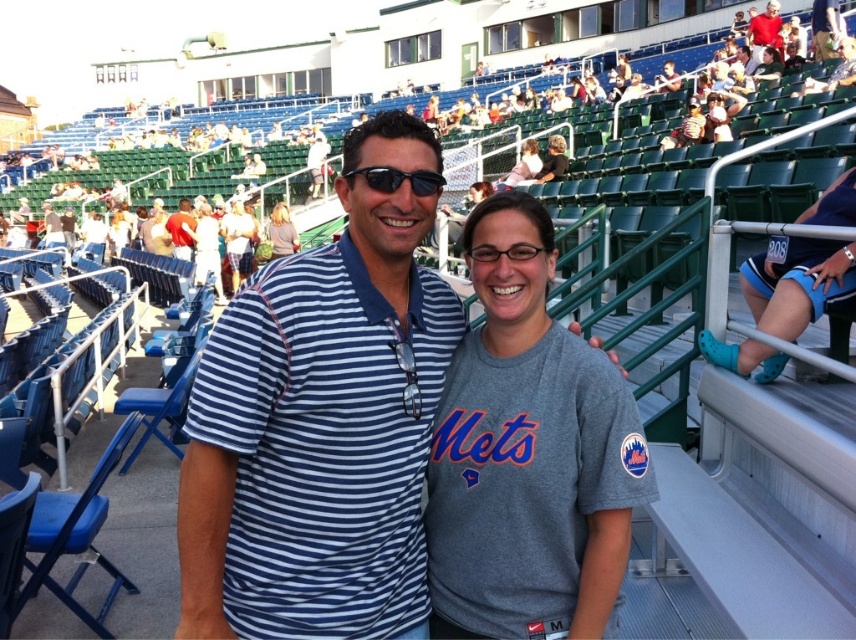
Who is positioned more to the right, blue striped polo shirt at center or gray cotton shirt at upper center?

gray cotton shirt at upper center

Does blue striped polo shirt at center appear on the left side of gray cotton shirt at upper center?

Correct, you'll find blue striped polo shirt at center to the left of gray cotton shirt at upper center.

Is point (396, 278) positioned behind point (560, 136)?

That is False.

Find the location of a particular element. blue striped polo shirt at center is located at coordinates (316, 438).

Is pink fabric at upper center closer to the viewer compared to matte black sunglasses at upper center?

Yes, it is.

Is point (520, 163) closer to viewer compared to point (313, 176)?

Yes, it is.

I want to click on pink fabric at upper center, so click(522, 166).

Identify the location of pink fabric at upper center. This screenshot has width=856, height=640. 522,166.

Which is more to the right, red shirt at upper right or black plastic glasses at center?

From the viewer's perspective, red shirt at upper right appears more on the right side.

Between red shirt at upper right and black plastic glasses at center, which one has more height?

red shirt at upper right

Which is behind, point (759, 17) or point (515, 244)?

Positioned behind is point (759, 17).

The width and height of the screenshot is (856, 640). Find the location of `red shirt at upper right`. red shirt at upper right is located at coordinates [x=765, y=29].